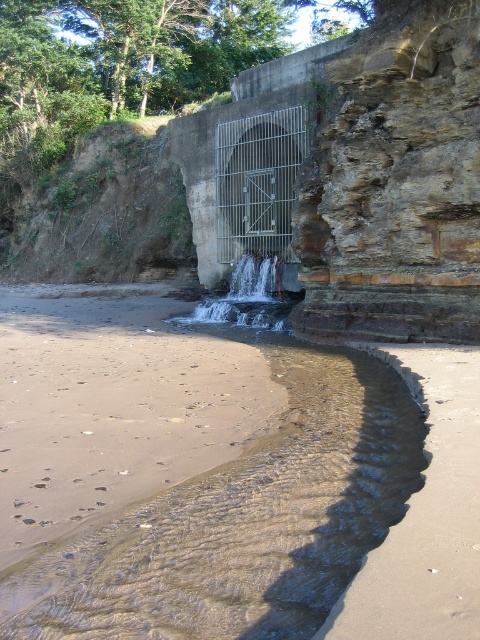
Which is above, clear sand at lower left or metal/cage at center?

metal/cage at center is higher up.

Is clear sand at lower left thinner than metal/cage at center?

No.

Where is `clear sand at lower left`? This screenshot has width=480, height=640. clear sand at lower left is located at coordinates (167, 460).

Can you confirm if metal/cage at center is shorter than clear glass waterfall at center?

Incorrect, metal/cage at center's height does not fall short of clear glass waterfall at center's.

In the scene shown: Can you confirm if metal/cage at center is wider than clear glass waterfall at center?

Correct, the width of metal/cage at center exceeds that of clear glass waterfall at center.

Where is `metal/cage at center`? The width and height of the screenshot is (480, 640). metal/cage at center is located at coordinates (257, 182).

Does clear sand at lower left lie in front of brown sandy beach at lower left?

Yes.

Between clear sand at lower left and brown sandy beach at lower left, which one is positioned lower?

clear sand at lower left is lower down.

What do you see at coordinates (167, 460) in the screenshot?
I see `clear sand at lower left` at bounding box center [167, 460].

The image size is (480, 640). I want to click on clear sand at lower left, so click(167, 460).